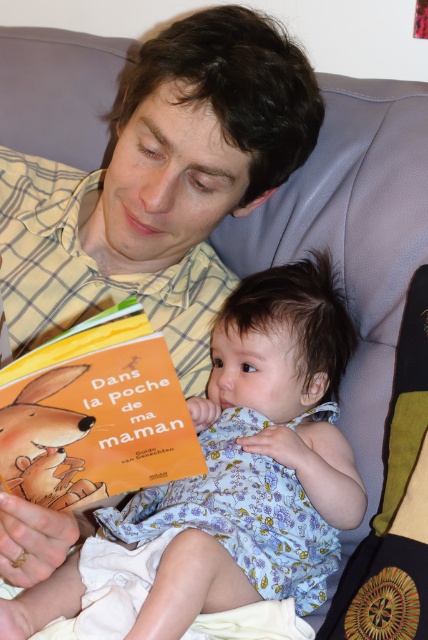
You are a photographer taking a picture of the scene. You want to focus on the point that is closer to the camera. Which point should you choose between point (181, 508) and point (58, 376)?

Point (58, 376) is closer to the camera than point (181, 508), so you should focus on point (58, 376).

Based on the scene, if the adult wants to place the orange matte book at center on top of the light blue fabric dress at center, will it fit without falling over?

The light blue fabric dress at center is taller than orange matte book at center, so placing the orange matte book at center on top of the light blue fabric dress at center would be stable and unlikely to fall over since the dress is taller and provides a secure base.

You are a photographer taking a picture of the scene. You need to ensure both the light blue fabric dress at center and the orange matte book at center are clearly visible. Which object should you focus on first to ensure the other remains in the frame?

The light blue fabric dress at center is positioned on the right side of the orange matte book at center, so focusing on the orange matte book at center first will keep the light blue fabric dress at center within the frame.